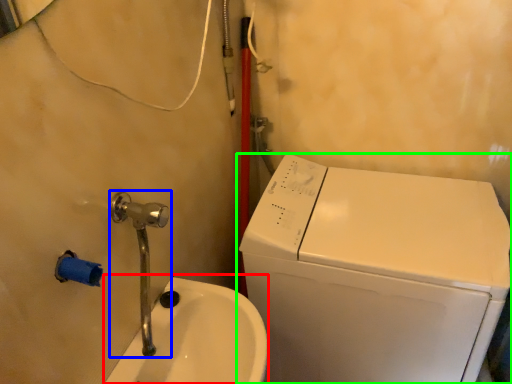
Question: Which object is positioned closest to sink (highlighted by a red box)? Select from plumbing fixture (highlighted by a blue box) and washing machine (highlighted by a green box).

Choices:
 (A) plumbing fixture
 (B) washing machine

Answer: (A)